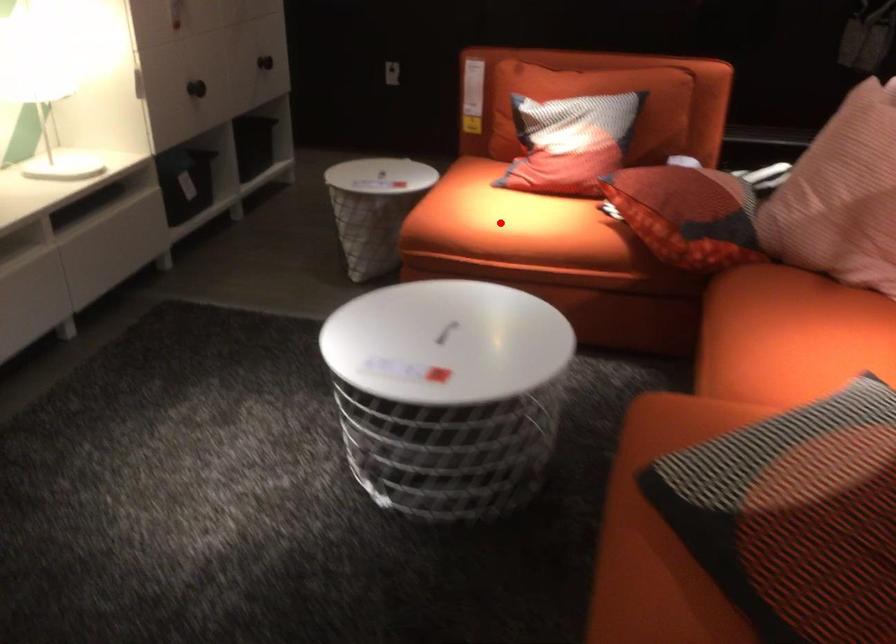
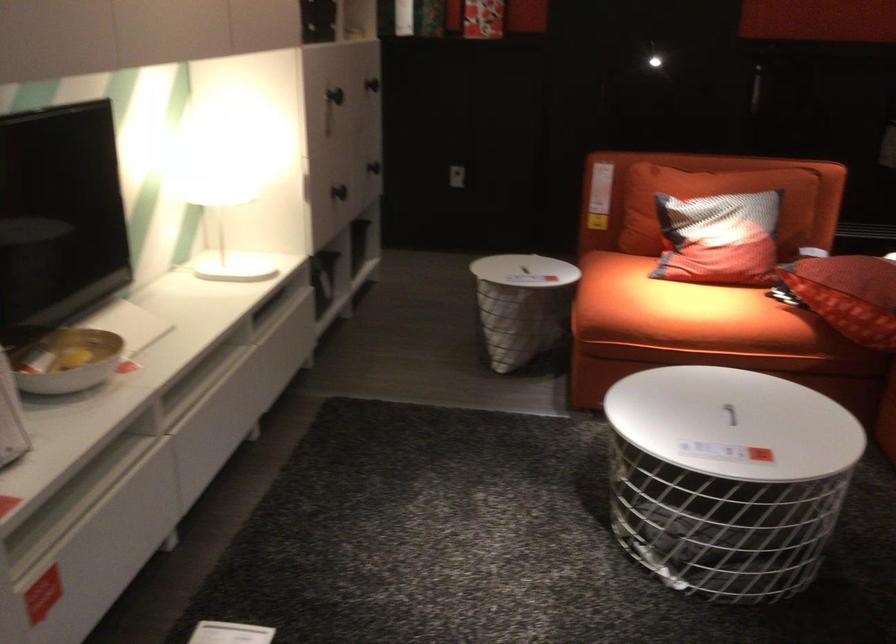
Where in the second image is the point corresponding to the highlighted location from the first image?

(684, 312)